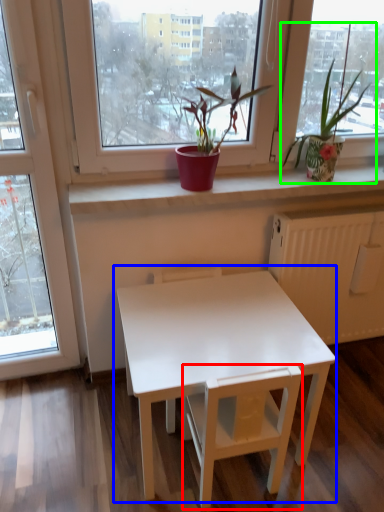
Question: Based on their relative distances, which object is farther from armchair (highlighted by a red box)? Choose from table (highlighted by a blue box) and houseplant (highlighted by a green box).

Choices:
 (A) table
 (B) houseplant

Answer: (B)